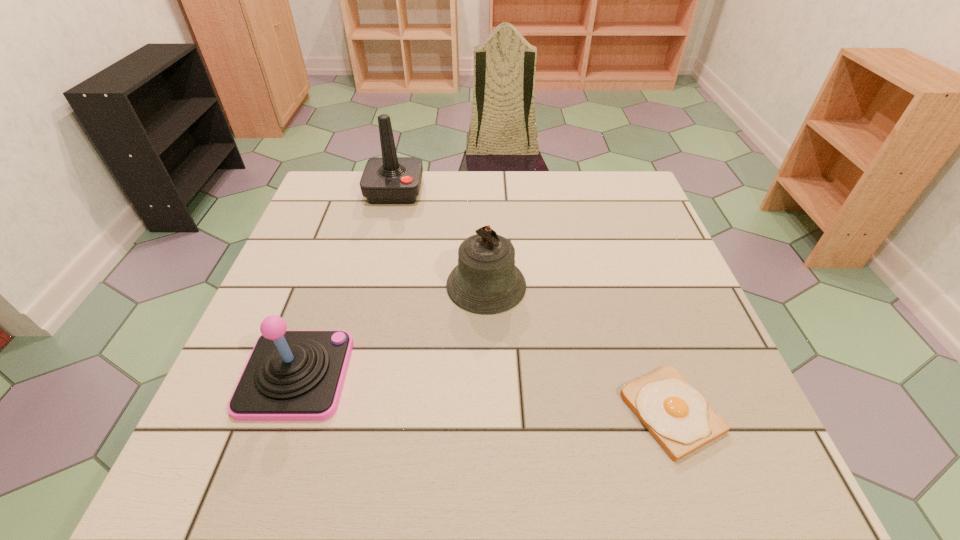
Locate an element on the screen. vacant point at the far left corner is located at coordinates (349, 206).

At what (x,y) coordinates should I click in order to perform the action: click on free space at the far right corner of the desktop. Please return your answer as a coordinate pair (x, y). This screenshot has height=540, width=960. Looking at the image, I should click on (611, 204).

I want to click on free space at the near right corner of the desktop, so click(x=708, y=450).

I want to click on unoccupied position between the nearer joystick and the toast, so click(x=484, y=394).

Locate an element on the screen. The height and width of the screenshot is (540, 960). vacant space in between the shortest object and the farther joystick is located at coordinates (533, 302).

The width and height of the screenshot is (960, 540). Find the location of `empty location between the tallest object and the third nearest object`. empty location between the tallest object and the third nearest object is located at coordinates (441, 238).

Locate an element on the screen. Image resolution: width=960 pixels, height=540 pixels. vacant space in between the toast and the farthest object is located at coordinates pos(533,302).

Where is `free point between the rightmost object and the farther joystick`? The height and width of the screenshot is (540, 960). free point between the rightmost object and the farther joystick is located at coordinates (533, 302).

You are a GUI agent. You are given a task and a screenshot of the screen. Output one action in this format:
    pyautogui.click(x=<x>, y=<y>)
    Task: Click on the free space between the nearer joystick and the toast
    The image size is (960, 540).
    Given the screenshot: What is the action you would take?
    (x=484, y=394)

Locate an element on the screen. The image size is (960, 540). empty space between the bell and the rightmost object is located at coordinates (579, 348).